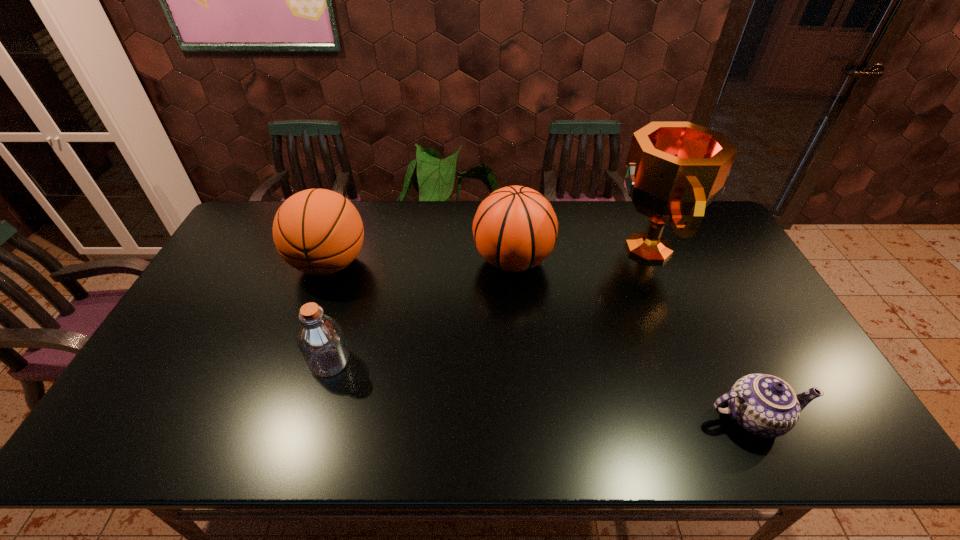
What are the coordinates of `free space at the near edge of the desktop` in the screenshot? It's located at (593, 439).

Image resolution: width=960 pixels, height=540 pixels. In the image, there is a desktop. Identify the location of vacant space at the left edge. (241, 297).

At what (x,y) coordinates should I click in order to perform the action: click on vacant space at the right edge. Please return your answer as a coordinate pair (x, y). Looking at the image, I should click on (720, 308).

Where is `free space at the far left corner of the desktop`? free space at the far left corner of the desktop is located at coordinates (263, 206).

What are the coordinates of `vacant space at the near left corner of the desktop` in the screenshot? It's located at coord(120,450).

This screenshot has height=540, width=960. In the image, there is a desktop. What are the coordinates of `free space at the far right corner` in the screenshot? It's located at (712, 239).

Image resolution: width=960 pixels, height=540 pixels. I want to click on vacant point located between the award and the chinaware, so click(700, 333).

Where is `vacant area that lies between the third object from left to right and the left basketball`? The height and width of the screenshot is (540, 960). vacant area that lies between the third object from left to right and the left basketball is located at coordinates (421, 262).

This screenshot has height=540, width=960. I want to click on free space between the second nearest object and the left basketball, so click(329, 313).

Identify the location of free space between the bottle and the left basketball. (329, 313).